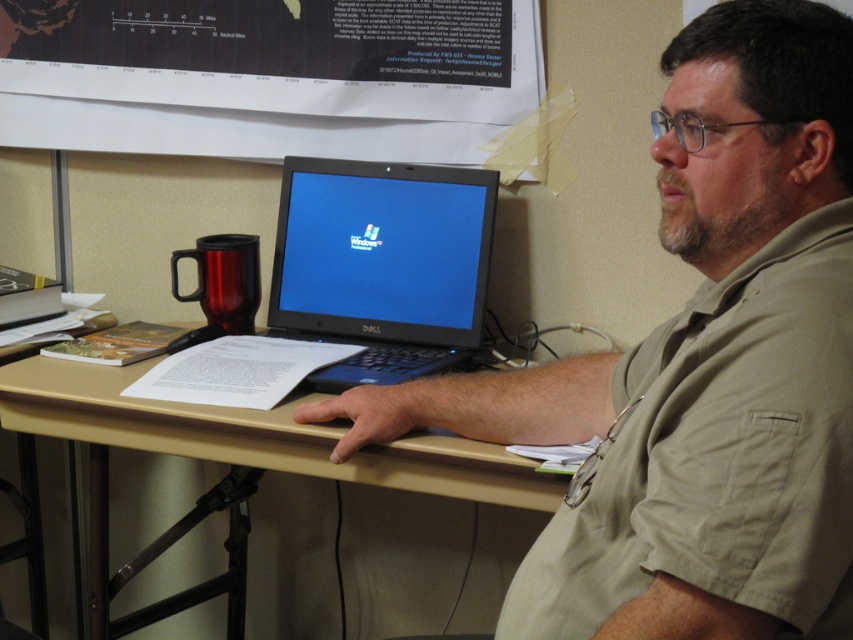
Which is behind, point (817, 42) or point (343, 376)?

Point (343, 376)

Is matte black laptop at center shorter than black plastic laptop at center?

In fact, matte black laptop at center may be taller than black plastic laptop at center.

Who is more distant from viewer, (821, 380) or (352, 177)?

Positioned behind is point (352, 177).

You are a GUI agent. You are given a task and a screenshot of the screen. Output one action in this format:
    pyautogui.click(x=<x>, y=<y>)
    Task: Click on the matte black laptop at center
    The height and width of the screenshot is (640, 853).
    Given the screenshot: What is the action you would take?
    pyautogui.click(x=698, y=369)

Does white paper at upper center have a greater height compared to black plastic laptop at center?

No, white paper at upper center is not taller than black plastic laptop at center.

Is white paper at upper center positioned at the back of black plastic laptop at center?

That is True.

Does point (363, 140) lie in front of point (358, 230)?

No, (363, 140) is further to viewer.

Where is `white paper at upper center`? white paper at upper center is located at coordinates (268, 76).

Can you confirm if matte black laptop at center is smaller than beige wood computer desk at center?

Indeed, matte black laptop at center has a smaller size compared to beige wood computer desk at center.

Can you confirm if matte black laptop at center is thinner than beige wood computer desk at center?

Indeed, matte black laptop at center has a lesser width compared to beige wood computer desk at center.

Between point (520, 573) and point (432, 474), which one is positioned in front?

Positioned in front is point (520, 573).

Identify the location of matte black laptop at center. (698, 369).